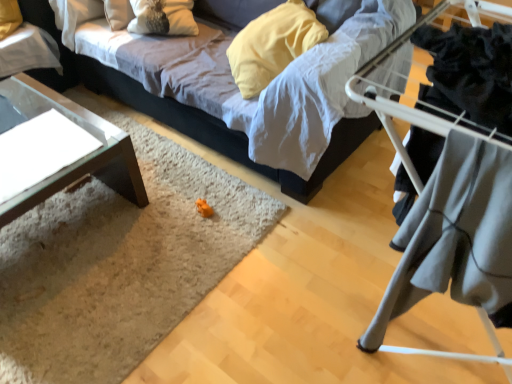
Question: From a real-world perspective, is gray fabric at right below clear glass table at upper left, arranged as the 1th table when viewed from the top?

Choices:
 (A) yes
 (B) no

Answer: (B)

Question: Does gray fabric at right have a greater width compared to clear glass table at upper left, arranged as the 1th table when viewed from the top?

Choices:
 (A) yes
 (B) no

Answer: (B)

Question: Is gray fabric at right beside clear glass table at upper left, arranged as the 1th table when viewed from the top?

Choices:
 (A) no
 (B) yes

Answer: (A)

Question: From a real-world perspective, is gray fabric at right located higher than clear glass table at upper left, the second table positioned from the bottom?

Choices:
 (A) yes
 (B) no

Answer: (A)

Question: Considering the relative positions of gray fabric at right and clear glass table at upper left, the second table positioned from the bottom, in the image provided, is gray fabric at right behind clear glass table at upper left, the second table positioned from the bottom,?

Choices:
 (A) yes
 (B) no

Answer: (B)

Question: Does gray fabric at right have a greater height compared to clear glass table at upper left, arranged as the 1th table when viewed from the top?

Choices:
 (A) yes
 (B) no

Answer: (A)

Question: From the image's perspective, is transparent glass table at lower left, which is the 1th table in bottom-to-top order, beneath gray fabric at right?

Choices:
 (A) yes
 (B) no

Answer: (B)

Question: Does transparent glass table at lower left, which is the 1th table in bottom-to-top order, have a smaller size compared to gray fabric at right?

Choices:
 (A) yes
 (B) no

Answer: (B)

Question: Is transparent glass table at lower left, which is the second table from top to bottom, at the left side of gray fabric at right?

Choices:
 (A) yes
 (B) no

Answer: (A)

Question: Is gray fabric at right a part of transparent glass table at lower left, which is the 1th table in bottom-to-top order?

Choices:
 (A) yes
 (B) no

Answer: (B)

Question: From a real-world perspective, is transparent glass table at lower left, which is the second table from top to bottom, positioned under gray fabric at right based on gravity?

Choices:
 (A) yes
 (B) no

Answer: (A)

Question: Could you tell me if transparent glass table at lower left, which is the 1th table in bottom-to-top order, is turned towards gray fabric at right?

Choices:
 (A) yes
 (B) no

Answer: (B)

Question: Is velvet fabric couch at center touching clear glass table at upper left, arranged as the 1th table when viewed from the top?

Choices:
 (A) no
 (B) yes

Answer: (A)